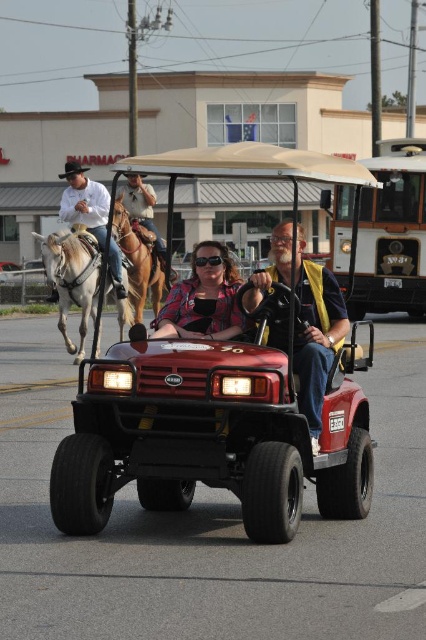
Question: Which of the following is the closest to the observer?

Choices:
 (A) white leather cowboy hat at upper left
 (B) white glossy horse at left
 (C) brown leather horse at center

Answer: (B)

Question: Can you confirm if plaid shirt at center is positioned below brown leather horse at center?

Choices:
 (A) no
 (B) yes

Answer: (B)

Question: Does white glossy horse at left have a lesser width compared to brown leather horse at center?

Choices:
 (A) yes
 (B) no

Answer: (B)

Question: Is shiny red golf cart at center closer to camera compared to white leather cowboy hat at upper left?

Choices:
 (A) yes
 (B) no

Answer: (A)

Question: Which of these objects is positioned closest to the shiny red golf cart at center?

Choices:
 (A) brown leather horse at center
 (B) yellow reflective vest at center
 (C) white leather cowboy hat at upper left

Answer: (B)

Question: Which of the following is the farthest from the observer?

Choices:
 (A) shiny red golf cart at center
 (B) white leather cowboy hat at upper left
 (C) yellow reflective vest at center
 (D) brown leather horse at center

Answer: (D)